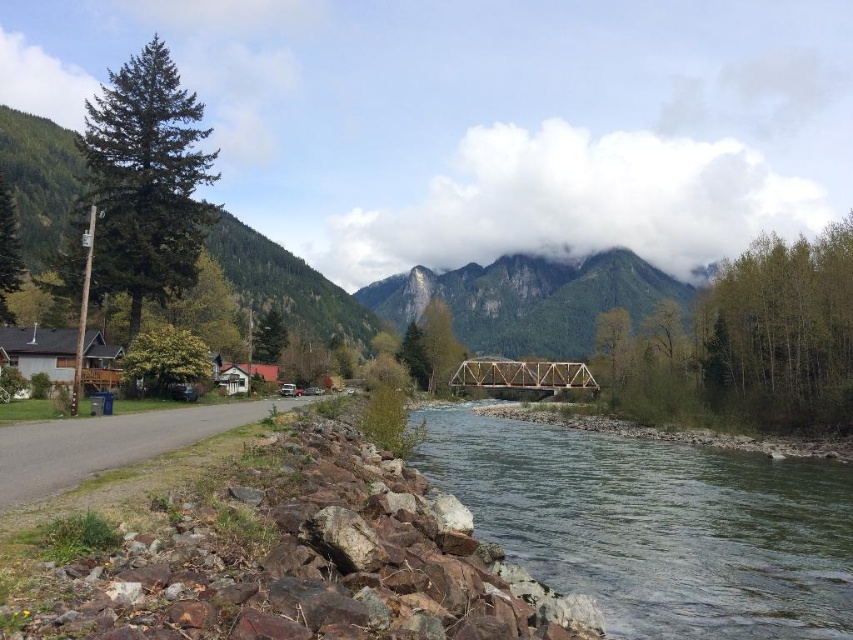
Between clear water at center and rugged stone mountain at center, which one is positioned higher?

Positioned higher is rugged stone mountain at center.

Is point (583, 502) closer to camera compared to point (529, 262)?

Yes, it is in front of point (529, 262).

Where is `clear water at center`? The image size is (853, 640). clear water at center is located at coordinates (654, 525).

Identify the location of clear water at center. The width and height of the screenshot is (853, 640). (654, 525).

What do you see at coordinates (654, 525) in the screenshot? I see `clear water at center` at bounding box center [654, 525].

This screenshot has width=853, height=640. Identify the location of clear water at center. (654, 525).

Is brown rock wall at lower left wider than clear water at center?

No, brown rock wall at lower left is not wider than clear water at center.

Based on the photo, is brown rock wall at lower left shorter than clear water at center?

Incorrect, brown rock wall at lower left's height does not fall short of clear water at center's.

What do you see at coordinates (303, 561) in the screenshot? I see `brown rock wall at lower left` at bounding box center [303, 561].

You are a GUI agent. You are given a task and a screenshot of the screen. Output one action in this format:
    pyautogui.click(x=<x>, y=<y>)
    Task: Click on the brown rock wall at lower left
    This screenshot has height=640, width=853.
    Given the screenshot: What is the action you would take?
    pyautogui.click(x=303, y=561)